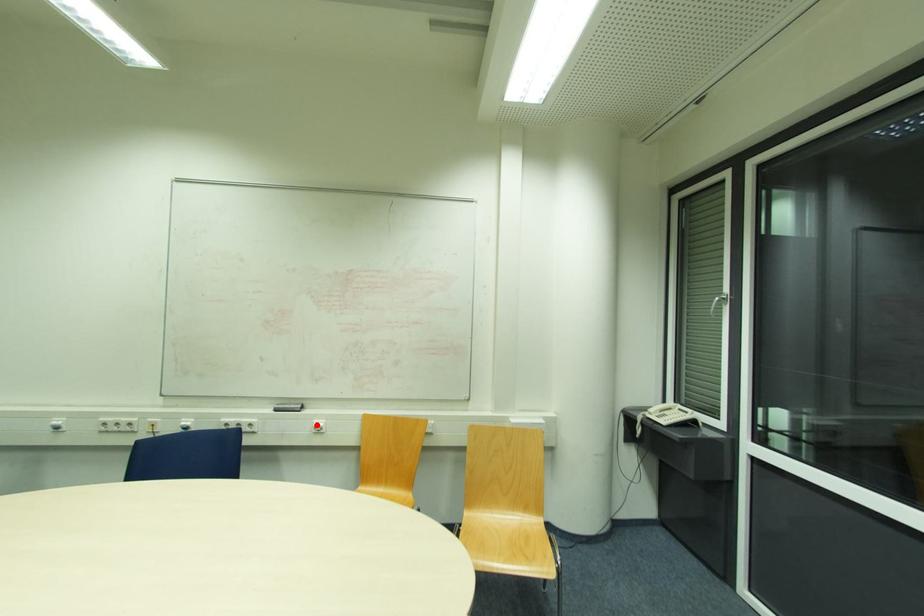
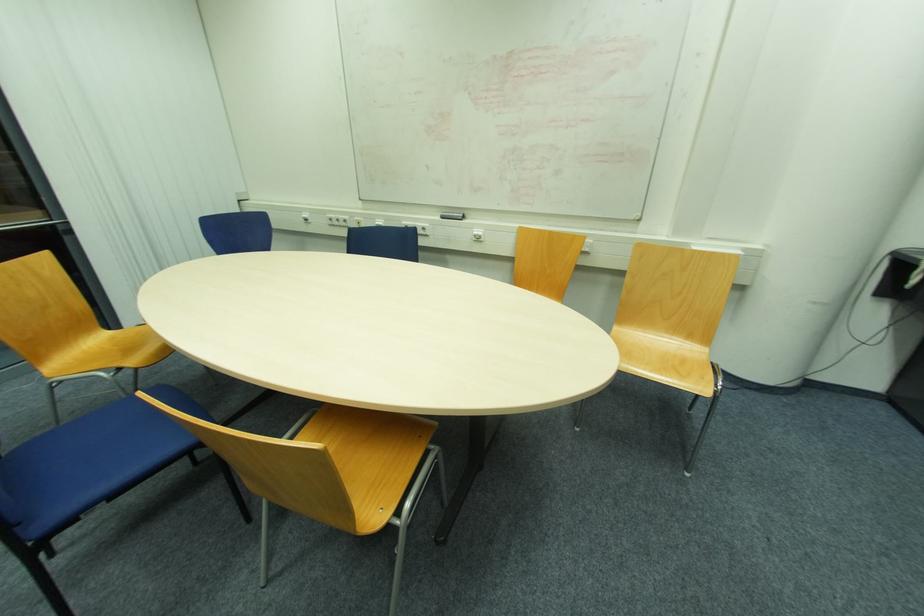
Find the pixel in the second image that matches the highlighted location in the first image.

(477, 233)